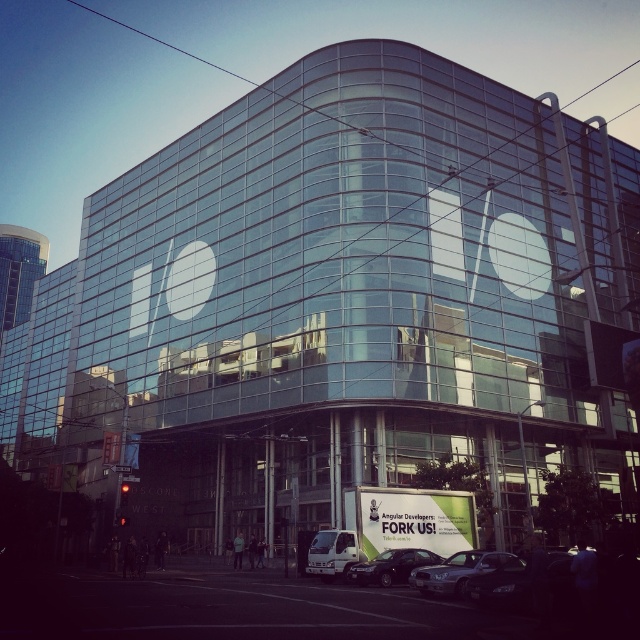
Is shiny black sedan at center below white metallic van at center?

Yes, shiny black sedan at center is below white metallic van at center.

Is shiny black sedan at center in front of white metallic van at center?

Yes, shiny black sedan at center is in front of white metallic van at center.

Find the location of a particular element. The height and width of the screenshot is (640, 640). shiny black sedan at center is located at coordinates (390, 566).

Which is above, metallic silver sedan at center or shiny black sedan at center?

metallic silver sedan at center is above.

Is point (445, 586) positioned after point (374, 556)?

That is False.

Between point (468, 577) and point (436, 557), which one is positioned in front?

Positioned in front is point (468, 577).

At what (x,y) coordinates should I click in order to perform the action: click on metallic silver sedan at center. Please return your answer as a coordinate pair (x, y). This screenshot has width=640, height=640. Looking at the image, I should click on (456, 572).

In the scene shown: Does shiny black sedan at lower center have a larger size compared to white metallic van at center?

Answer: No.

Between shiny black sedan at lower center and white metallic van at center, which one is positioned higher?

shiny black sedan at lower center

Measure the distance between point (493, 573) and camera.

A distance of 32.81 meters exists between point (493, 573) and camera.

You are a GUI agent. You are given a task and a screenshot of the screen. Output one action in this format:
    pyautogui.click(x=<x>, y=<y>)
    Task: Click on the shiny black sedan at lower center
    Image resolution: width=640 pixels, height=640 pixels.
    Given the screenshot: What is the action you would take?
    pyautogui.click(x=502, y=586)